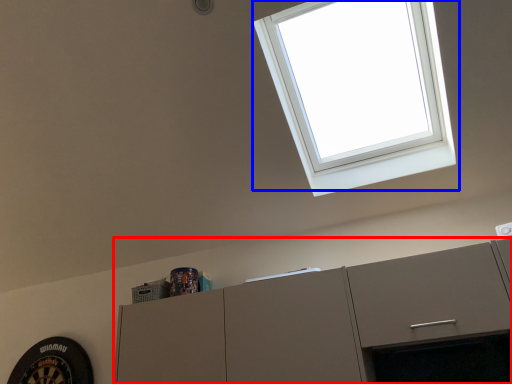
Question: Which object is closer to the camera taking this photo, cabinetry (highlighted by a red box) or window (highlighted by a blue box)?

Choices:
 (A) cabinetry
 (B) window

Answer: (B)